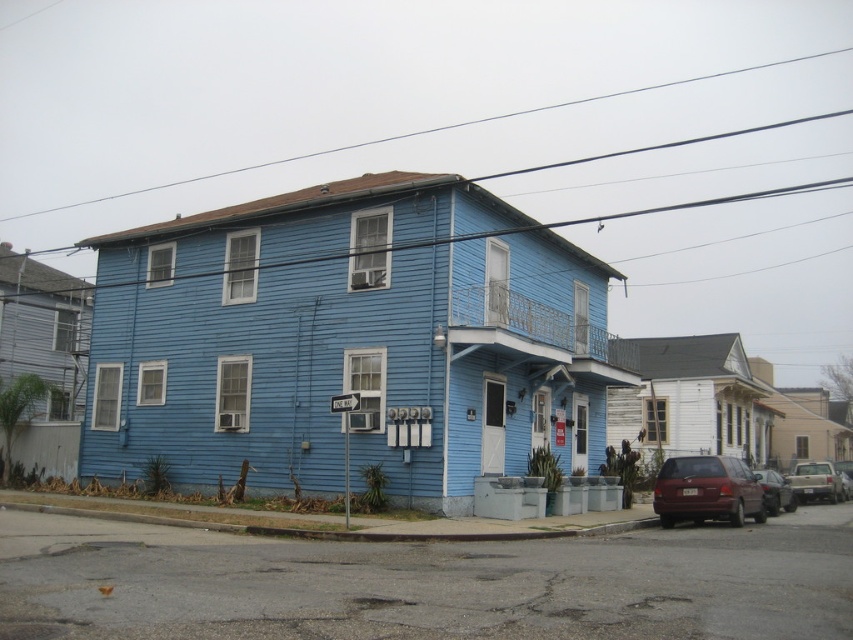
Question: Which of these objects is positioned farthest from the silver metallic suv at lower right?

Choices:
 (A) matte maroon van at lower right
 (B) white wood trim at center
 (C) metallic silver car at lower right

Answer: (A)

Question: Does silver metallic suv at lower right have a larger size compared to metallic silver car at lower right?

Choices:
 (A) no
 (B) yes

Answer: (B)

Question: Estimate the real-world distances between objects in this image. Which object is farther from the silver metallic suv at lower right?

Choices:
 (A) white wood trim at center
 (B) metallic silver car at lower right
 (C) matte maroon van at lower right

Answer: (C)

Question: Estimate the real-world distances between objects in this image. Which object is closer to the matte maroon van at lower right?

Choices:
 (A) metallic silver car at lower right
 (B) white wood trim at center

Answer: (A)

Question: Does matte maroon van at lower right have a greater width compared to metallic silver car at lower right?

Choices:
 (A) yes
 (B) no

Answer: (B)

Question: Does white wood trim at center appear on the right side of matte maroon van at lower right?

Choices:
 (A) no
 (B) yes

Answer: (A)